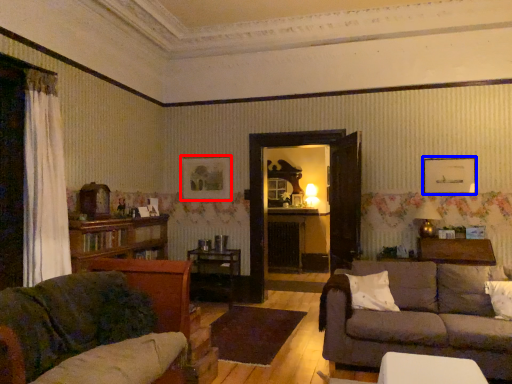
Question: Among these objects, which one is nearest to the camera, picture frame (highlighted by a red box) or picture frame (highlighted by a blue box)?

Choices:
 (A) picture frame
 (B) picture frame

Answer: (B)